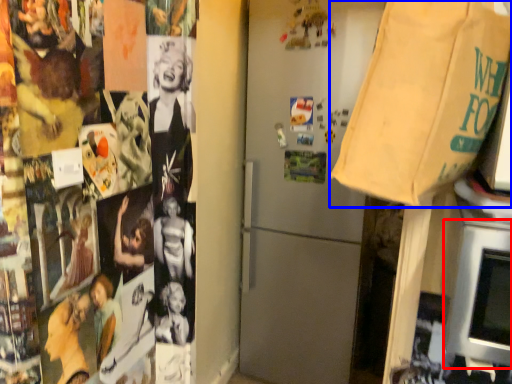
Question: Which point is closer to the camera, oven (highlighted by a red box) or grocery bag (highlighted by a blue box)?

Choices:
 (A) oven
 (B) grocery bag

Answer: (B)